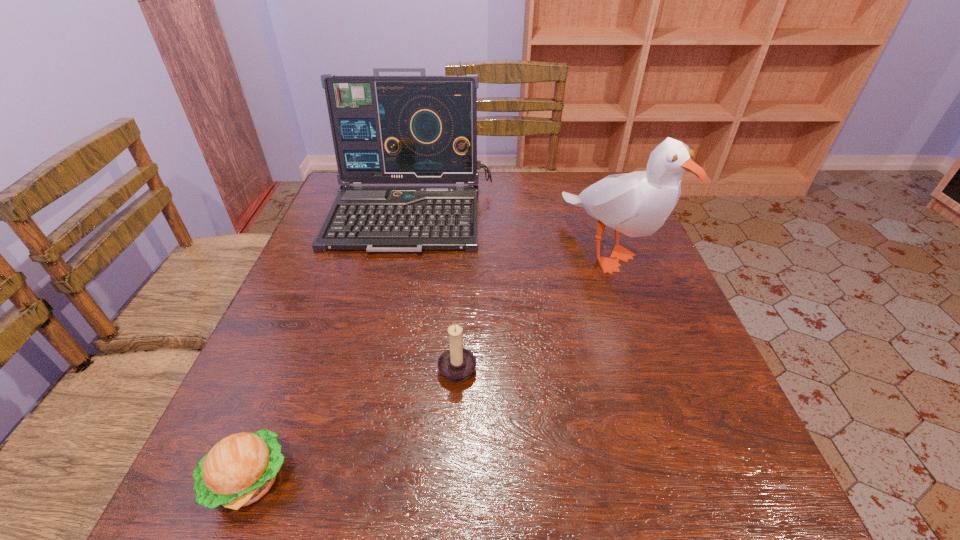
Identify the location of laptop computer. (422, 129).

Identify the location of the rightmost object. This screenshot has width=960, height=540. (637, 204).

Where is `the second shortest object`? The image size is (960, 540). the second shortest object is located at coordinates (456, 364).

Locate an element on the screen. The image size is (960, 540). the third farthest object is located at coordinates (456, 364).

I want to click on hamburger, so click(241, 468).

What are the coordinates of `the nearest object` in the screenshot? It's located at (241, 468).

This screenshot has height=540, width=960. I want to click on vacant region located 0.360m on the front-facing side of the laptop computer, so click(x=376, y=379).

Find the location of `vacant space located at the beak of the rightmost object`. vacant space located at the beak of the rightmost object is located at coordinates (671, 428).

Where is `free space located 0.180m on the wick of the third farthest object`? free space located 0.180m on the wick of the third farthest object is located at coordinates click(x=572, y=366).

The image size is (960, 540). Find the location of `vacant region located 0.300m on the right of the hamburger`. vacant region located 0.300m on the right of the hamburger is located at coordinates (490, 481).